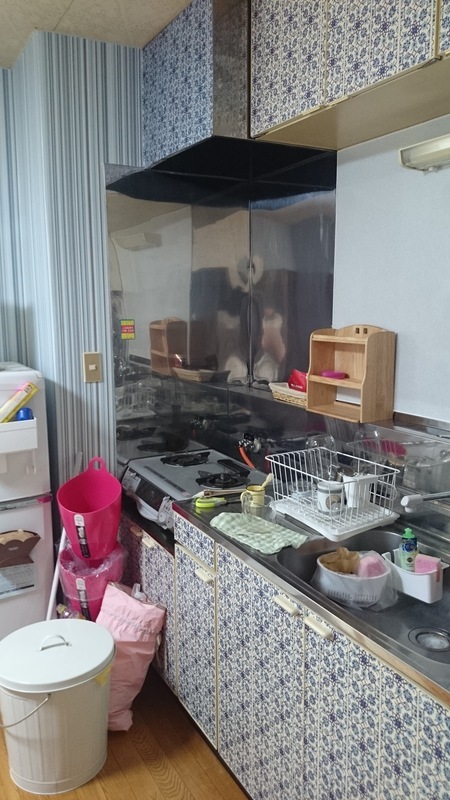
Point out all instances of where to lift trashcan lid in the image. Your answer should be formatted as a list of tuples, i.e. [(x1, y1), (x2, y2), ...], where each tuple contains the x and y coordinates of a point satisfying the conditions above.

[(60, 634)]